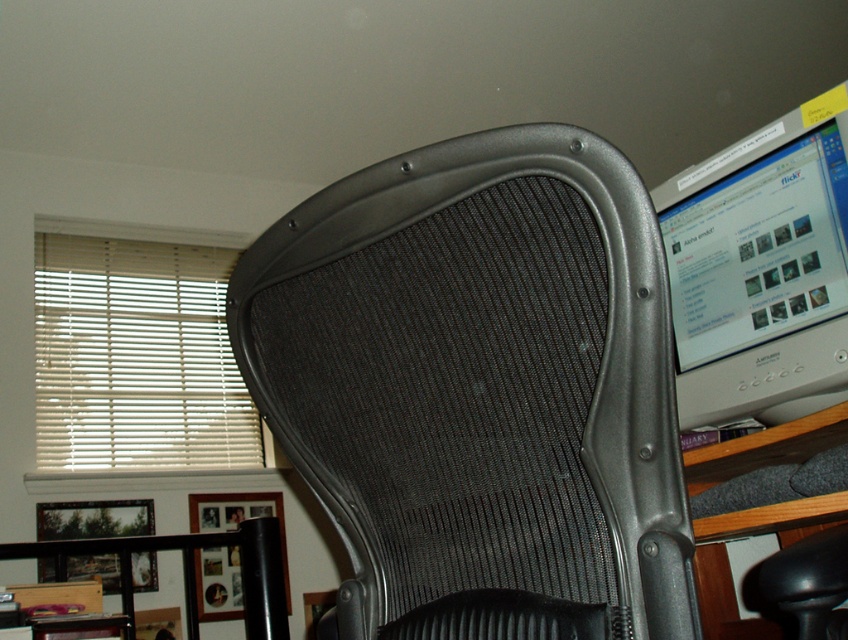
You are standing in front of the black office chair with a mesh backrest and a gray frame. You notice two points marked on the image at coordinates point (584, 291) and point (190, 314). Which of these points is closer to you?

Point (584, 291) is in front of point (190, 314), so it is closer to you.